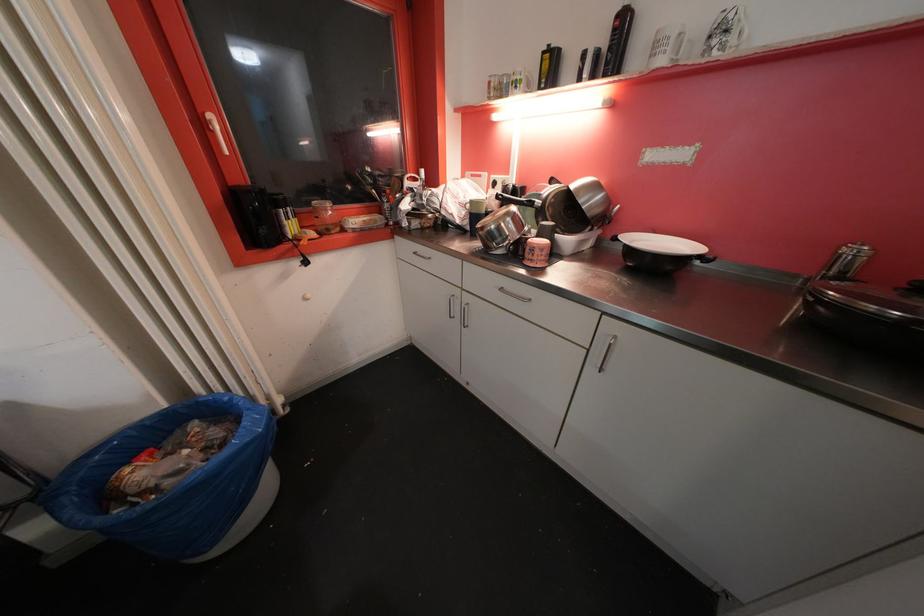
Describe the element at coordinates (708, 260) in the screenshot. The image size is (924, 616). I see `a pan lid handle` at that location.